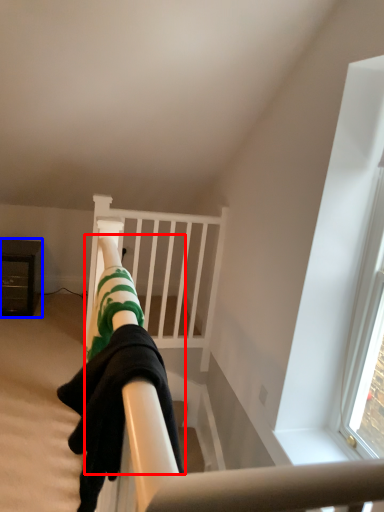
Question: Which of the following is the farthest to the observer, person (highlighted by a red box) or furniture (highlighted by a blue box)?

Choices:
 (A) person
 (B) furniture

Answer: (B)